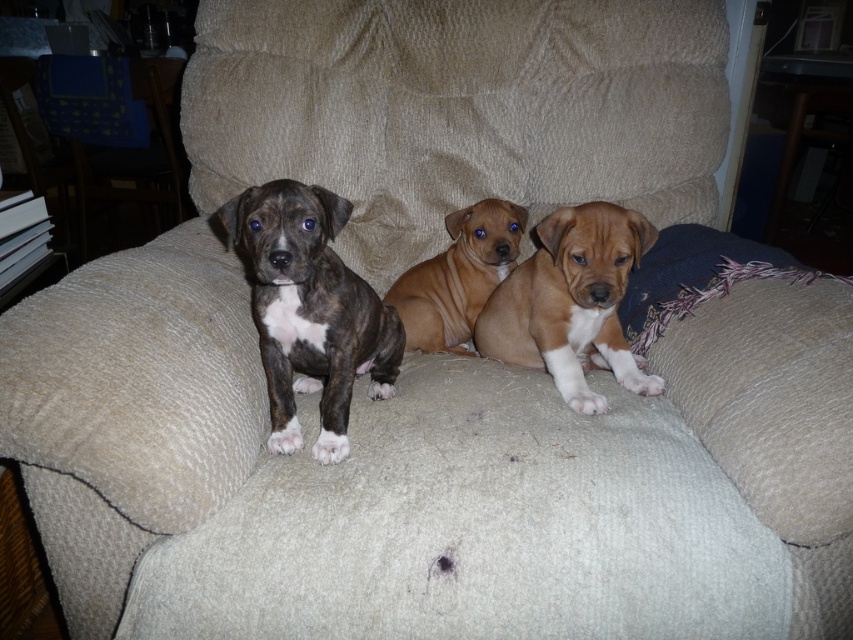
Who is positioned more to the right, brown smooth puppy at center or brown smooth dog at center?

brown smooth puppy at center

Where is `brown smooth puppy at center`? Image resolution: width=853 pixels, height=640 pixels. brown smooth puppy at center is located at coordinates (572, 301).

Locate an element on the screen. The height and width of the screenshot is (640, 853). brown smooth puppy at center is located at coordinates (572, 301).

The width and height of the screenshot is (853, 640). What are the coordinates of `brown smooth puppy at center` in the screenshot? It's located at point(572,301).

Locate an element on the screen. The image size is (853, 640). brindle fur puppy at left is located at coordinates (310, 310).

You are a GUI agent. You are given a task and a screenshot of the screen. Output one action in this format:
    pyautogui.click(x=<x>, y=<y>)
    Task: Click on the brindle fur puppy at left
    
    Given the screenshot: What is the action you would take?
    pyautogui.click(x=310, y=310)

Which is in front, point (317, 253) or point (601, 339)?

Point (317, 253)

Is brindle fur puppy at left taller than brown smooth puppy at center?

Indeed, brindle fur puppy at left has a greater height compared to brown smooth puppy at center.

Which is in front, point (340, 228) or point (543, 301)?

Positioned in front is point (340, 228).

Image resolution: width=853 pixels, height=640 pixels. I want to click on brindle fur puppy at left, so click(x=310, y=310).